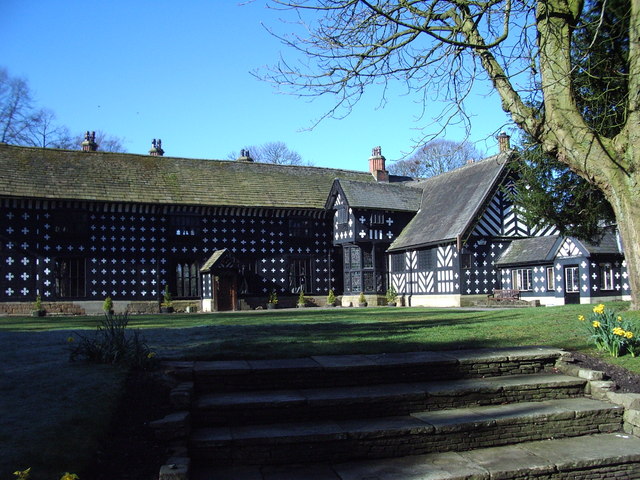
Identify the location of chimney. The height and width of the screenshot is (480, 640). (377, 158).